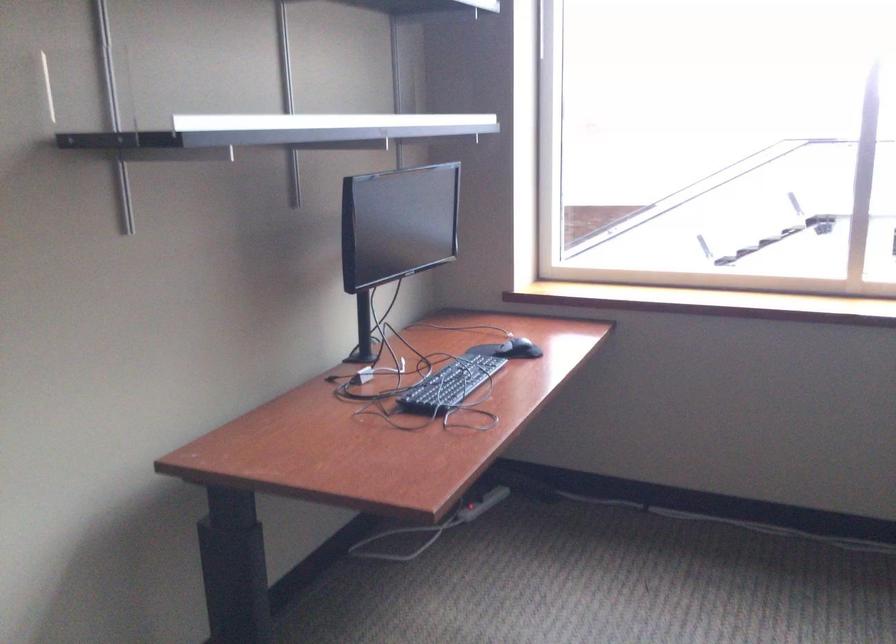
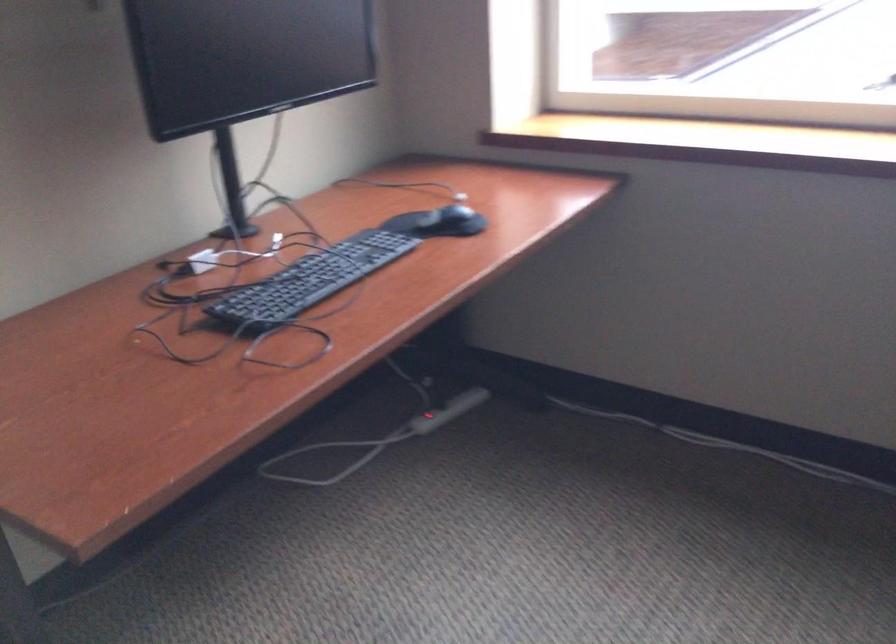
In the second image, find the point that corresponds to pixel 517 343 in the first image.

(452, 212)